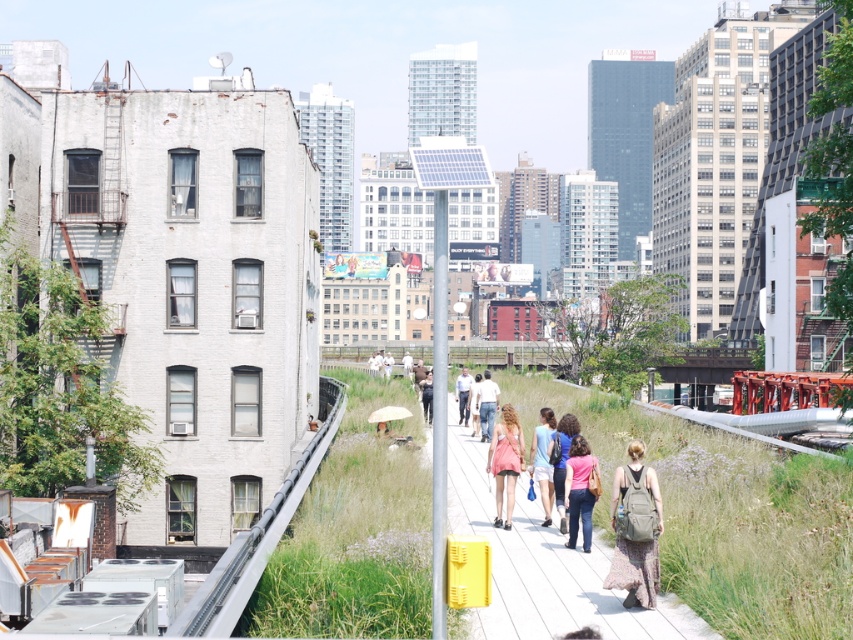
Question: Does denim shorts at center appear on the left side of beige fabric umbrella at center?

Choices:
 (A) yes
 (B) no

Answer: (B)

Question: Which of these objects is positioned farthest from the metallic gray train track at left?

Choices:
 (A) pink fabric dress at center
 (B) denim shorts at center
 (C) pink fabric backpack at center
 (D) white wooden pavement at center

Answer: (A)

Question: Considering the real-world distances, which object is closest to the light blue shirt at center?

Choices:
 (A) denim shorts at center
 (B) pink fabric dress at center

Answer: (A)

Question: Among these points, which one is nearest to the camera?

Choices:
 (A) [x=473, y=394]
 (B) [x=426, y=401]

Answer: (A)

Question: Is matte blue shirt at center to the right of light blue jeans at center from the viewer's perspective?

Choices:
 (A) yes
 (B) no

Answer: (A)

Question: Does matte blue shirt at center have a lesser width compared to light pink fabric dress at center?

Choices:
 (A) no
 (B) yes

Answer: (A)